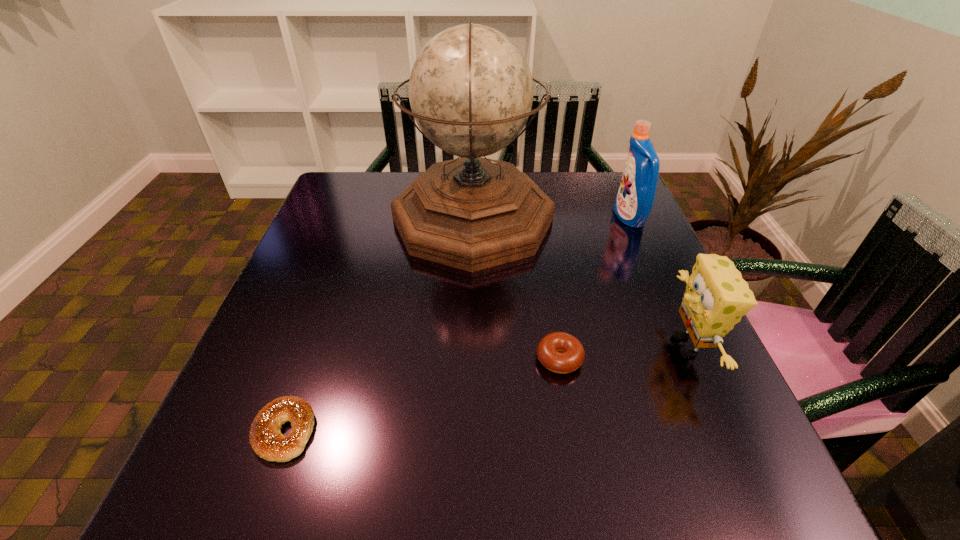
I want to click on vacant space situated on the face of the third shortest object, so click(600, 346).

Find the location of a particular element. free space located 0.160m on the face of the third shortest object is located at coordinates (579, 346).

This screenshot has height=540, width=960. Identify the location of free location located on the face of the third shortest object. (574, 346).

The image size is (960, 540). I want to click on free region located 0.190m on the right of the second shortest object, so click(x=686, y=359).

The image size is (960, 540). In order to click on blank space located on the right of the shortest object in this screenshot , I will do `click(520, 431)`.

The image size is (960, 540). In order to click on globe that is at the far edge in this screenshot , I will do `click(471, 90)`.

Where is `detergent positioned at the far edge`? detergent positioned at the far edge is located at coordinates (635, 198).

Where is `object located in the near edge section of the desktop`? Image resolution: width=960 pixels, height=540 pixels. object located in the near edge section of the desktop is located at coordinates (267, 441).

In order to click on object at the left edge in this screenshot , I will do `click(267, 441)`.

The image size is (960, 540). I want to click on detergent present at the right edge, so click(x=635, y=198).